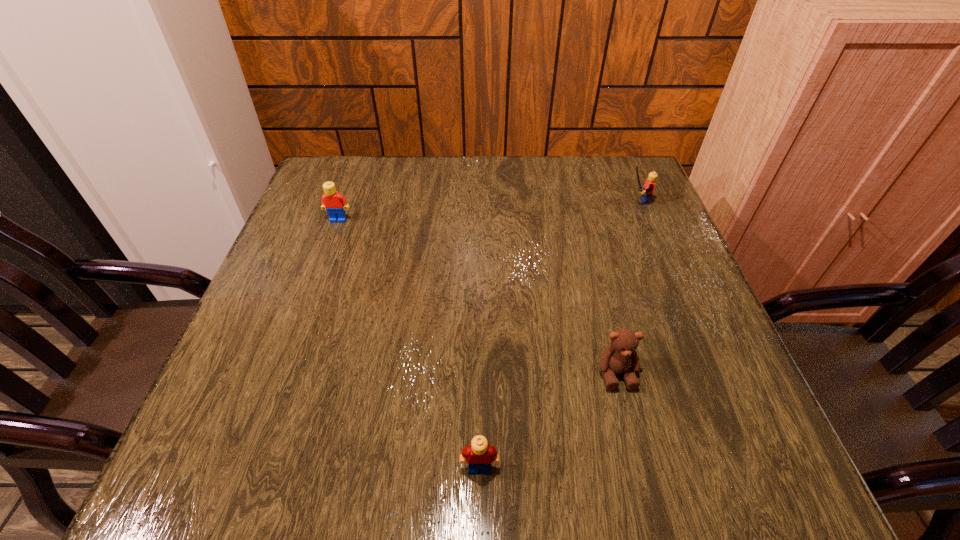
Find the location of a particular element. This screenshot has height=540, width=960. free space located on the front-facing side of the rightmost object is located at coordinates (488, 201).

Find the location of `free point located 0.170m on the face of the second nearest Lego`. free point located 0.170m on the face of the second nearest Lego is located at coordinates (320, 273).

Image resolution: width=960 pixels, height=540 pixels. I want to click on free space located on the face of the second object from right to left, so click(x=636, y=449).

Locate an element on the screen. The image size is (960, 540). object at the far edge is located at coordinates (646, 193).

Find the location of a particular element. object that is positioned at the near edge is located at coordinates (479, 454).

Identify the location of object positioned at the left edge. (335, 204).

The height and width of the screenshot is (540, 960). In order to click on object that is at the right edge in this screenshot , I will do `click(646, 193)`.

Locate an element on the screen. The height and width of the screenshot is (540, 960). object that is positioned at the far right corner is located at coordinates (646, 193).

The image size is (960, 540). Find the location of `vacant point at the far edge`. vacant point at the far edge is located at coordinates (536, 183).

You are a GUI agent. You are given a task and a screenshot of the screen. Output one action in this format:
    pyautogui.click(x=<x>, y=<y>)
    Task: Click on the free space at the left edge of the desktop
    This screenshot has height=540, width=960.
    Given the screenshot: What is the action you would take?
    click(315, 213)